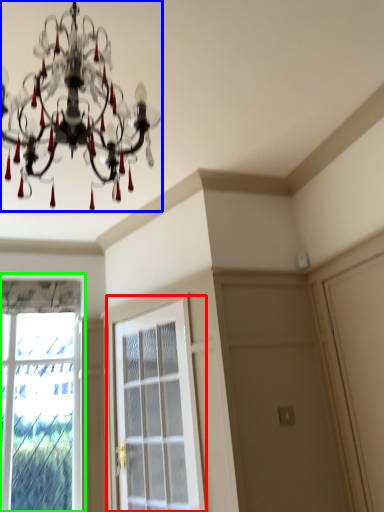
Question: Based on their relative distances, which object is farther from screen door (highlighted by a red box)? Choose from lamp (highlighted by a blue box) and window (highlighted by a green box).

Choices:
 (A) lamp
 (B) window

Answer: (A)